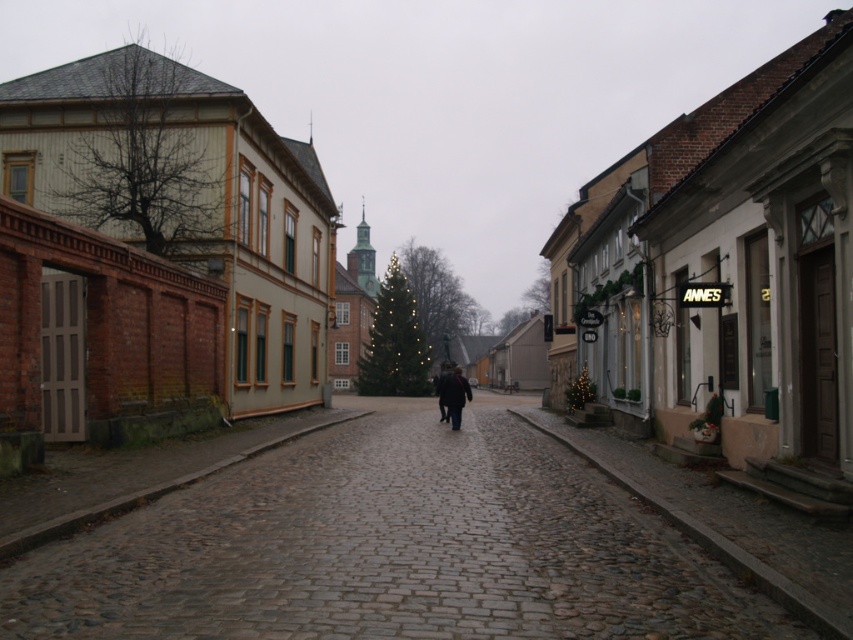
Find the location of a particular element. cobblestone street at center is located at coordinates (389, 548).

This screenshot has height=640, width=853. In order to click on cobblestone street at center in this screenshot , I will do `click(389, 548)`.